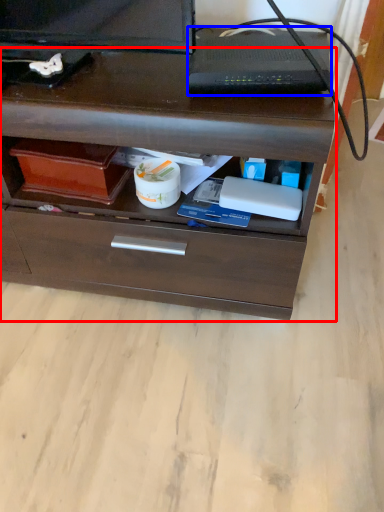
Question: Among these objects, which one is farthest to the camera, chest of drawers (highlighted by a red box) or appliance (highlighted by a blue box)?

Choices:
 (A) chest of drawers
 (B) appliance

Answer: (B)